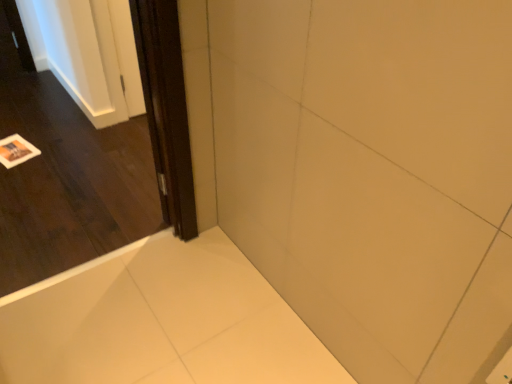
The height and width of the screenshot is (384, 512). I want to click on free location in front of dark wood door at left, so click(84, 328).